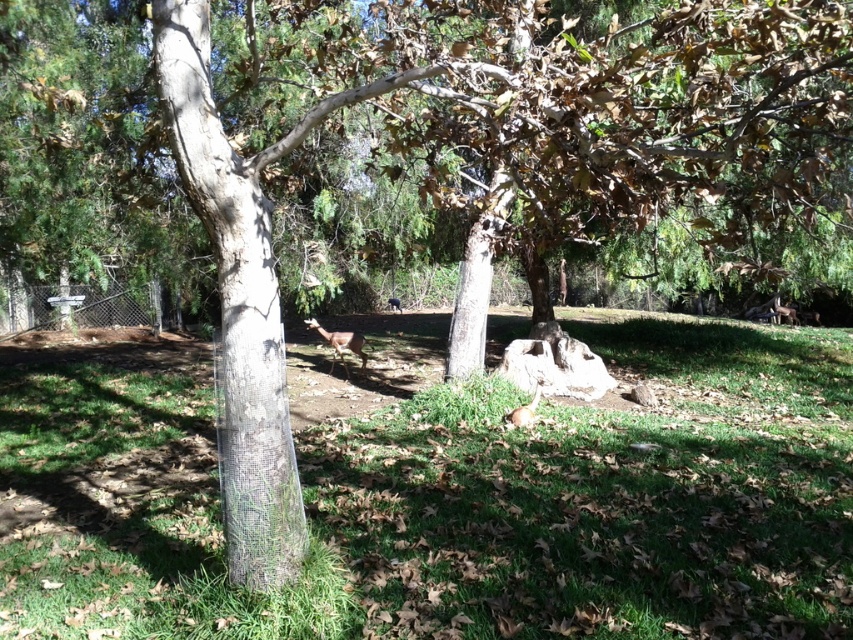
Question: Is green grassy at center to the left of brown furry deer at lower right from the viewer's perspective?

Choices:
 (A) yes
 (B) no

Answer: (A)

Question: Among these objects, which one is nearest to the camera?

Choices:
 (A) brown fur deer at center
 (B) brown furry deer at center

Answer: (B)

Question: Which point is farther to the camera?

Choices:
 (A) (196, 74)
 (B) (399, 308)

Answer: (B)

Question: Is clear plastic tree trunk at left to the left of brown furry deer at center from the viewer's perspective?

Choices:
 (A) no
 (B) yes

Answer: (A)

Question: Is green grassy at center to the right of brown furry deer at lower right from the viewer's perspective?

Choices:
 (A) yes
 (B) no

Answer: (B)

Question: Which is nearer to the clear plastic tree trunk at left?

Choices:
 (A) brown furry rabbit at center
 (B) brown fur deer at center
 (C) brown furry deer at lower right
 (D) green grassy at center

Answer: (A)